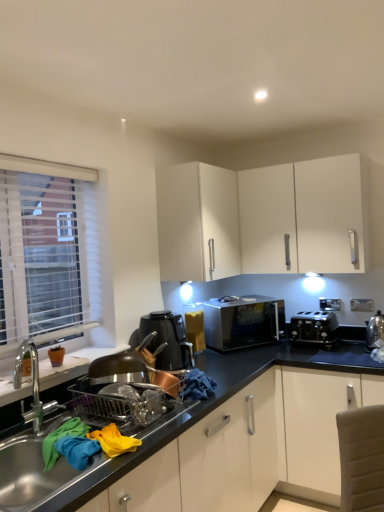
Locate an element on the screen. blank area beneath white blinds at left (from a real-world perspective) is located at coordinates (55, 357).